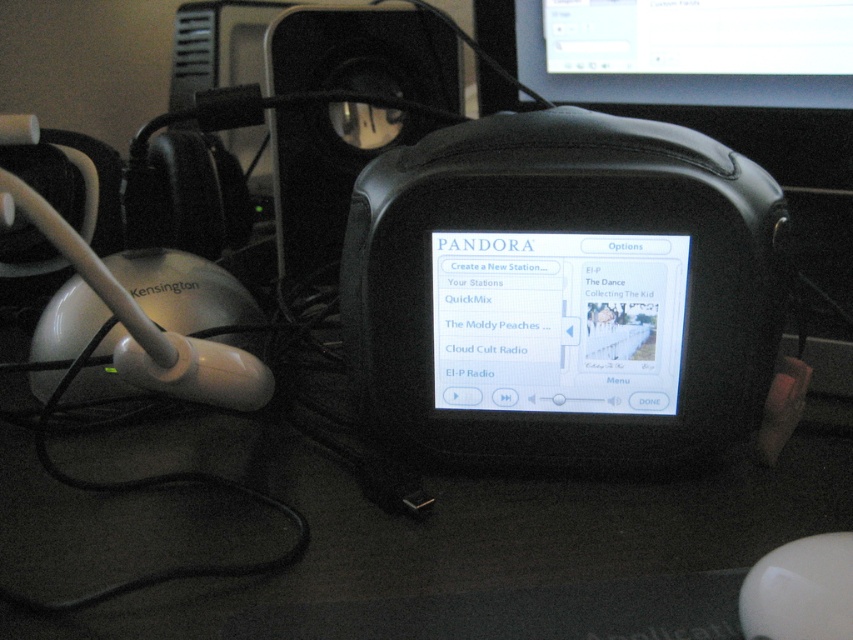
You are setting up a home office and need to arrange your devices properly. According to the image, where is the matte black monitor at upper center in relation to the black plastic speaker at center?

The matte black monitor at upper center is to the right of the black plastic speaker at center.

You are setting up a new workspace and want to place a small plant between the matte black monitor at upper center and the white glossy mouse at lower right. Based on their positions, which object is closer to you, and where should you position the plant to ensure it is equidistant from both?

The matte black monitor at upper center is closer to you than the white glossy mouse at lower right. To place the plant equidistant from both, position it closer to the white glossy mouse at lower right since the monitor is nearer to you.